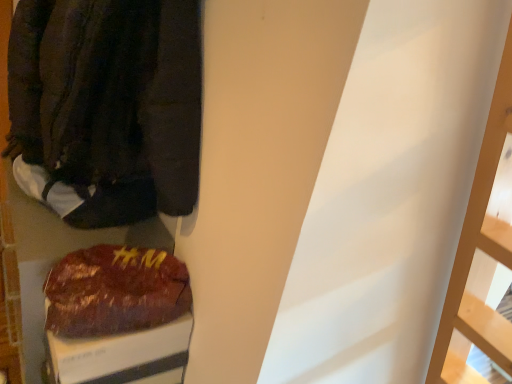
Question: Is dark brown fabric jacket at left spatially inside shiny brown bag at lower left, or outside of it?

Choices:
 (A) outside
 (B) inside

Answer: (A)

Question: In the image, is dark brown fabric jacket at left on the left side or the right side of shiny brown bag at lower left?

Choices:
 (A) right
 (B) left

Answer: (A)

Question: Which object is the farthest from the shiny brown bag at lower left?

Choices:
 (A) white fabric shoe at left
 (B) dark brown fabric jacket at left

Answer: (B)

Question: Which is farther from the shiny brown bag at lower left?

Choices:
 (A) dark brown fabric jacket at left
 (B) white fabric shoe at left

Answer: (A)